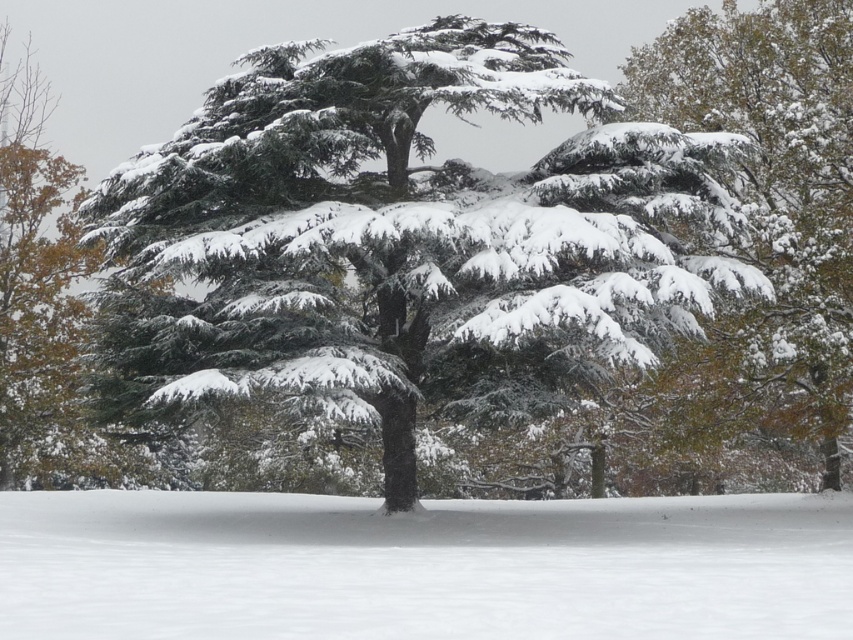
You are standing in the winter forest and want to take a photo of the green matte tree at center. Where should you position yourself to ensure the tree is centered in your camera frame?

To center the green matte tree at center in your camera frame, position yourself directly in front of it at point (410, 237).

You are an observer standing in the winter scene. You notice the white fluffy snow at center and the green matte tree at left. Which object appears taller from your viewpoint?

The green matte tree at left is taller than the white fluffy snow at center.

You are standing in a snowy forest and want to take a photo of the green matte tree at center. If your camera has a maximum focus range of 20 meters, will you be able to focus on the tree?

The green matte tree at center is 21.46 meters away from the camera, which exceeds the camera maximum focus range of 20 meters. Therefore, the camera cannot focus on the tree.